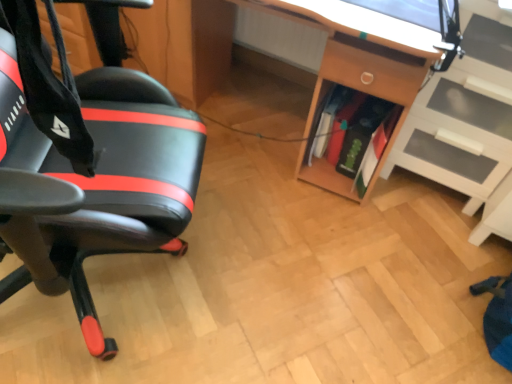
Question: Is black leather chair at left wider or thinner than green matte book at center, the 3th book from the back?

Choices:
 (A) thin
 (B) wide

Answer: (B)

Question: Is point (5, 286) positioned closer to the camera than point (388, 117)?

Choices:
 (A) farther
 (B) closer

Answer: (B)

Question: Considering the real-world distances, which object is farthest from the green matte book at center, the 3th book from the back?

Choices:
 (A) green matte book at center, which ranks as the 2th book in back-to-front order
 (B) white glossy shelf at right
 (C) wooden desk at center
 (D) green matte book at center, which appears as the first book when viewed from the back
 (E) black leather chair at left

Answer: (E)

Question: Which of these objects is positioned farthest from the wooden desk at center?

Choices:
 (A) green matte book at center, acting as the first book starting from the front
 (B) green matte book at center, which ranks as the 2th book in back-to-front order
 (C) white glossy shelf at right
 (D) green matte book at center, placed as the 3th book when sorted from front to back
 (E) black leather chair at left

Answer: (E)